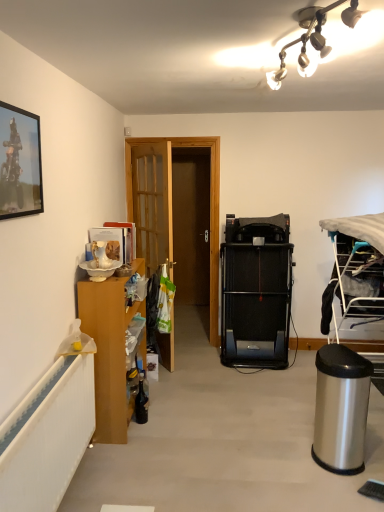
Question: Is wooden cabinet at left facing away from metallic silver picture frame at upper left?

Choices:
 (A) yes
 (B) no

Answer: (B)

Question: Can you confirm if wooden cabinet at left is shorter than metallic silver picture frame at upper left?

Choices:
 (A) no
 (B) yes

Answer: (A)

Question: Is metallic silver picture frame at upper left completely or partially inside wooden cabinet at left?

Choices:
 (A) yes
 (B) no

Answer: (B)

Question: Is wooden cabinet at left closer to camera compared to metallic silver picture frame at upper left?

Choices:
 (A) no
 (B) yes

Answer: (A)

Question: Does wooden cabinet at left have a greater width compared to metallic silver picture frame at upper left?

Choices:
 (A) no
 (B) yes

Answer: (B)

Question: In terms of size, does metallic silver picture frame at upper left appear bigger or smaller than wooden cabinet at left?

Choices:
 (A) big
 (B) small

Answer: (B)

Question: Choose the correct answer: Is metallic silver picture frame at upper left inside wooden cabinet at left or outside it?

Choices:
 (A) outside
 (B) inside

Answer: (A)

Question: Looking at their shapes, would you say metallic silver picture frame at upper left is wider or thinner than wooden cabinet at left?

Choices:
 (A) thin
 (B) wide

Answer: (A)

Question: From the image's perspective, relative to wooden cabinet at left, is metallic silver picture frame at upper left above or below?

Choices:
 (A) below
 (B) above

Answer: (B)

Question: From a real-world perspective, is wooden cabinet at left physically located above or below metallic silver picture frame at upper left?

Choices:
 (A) below
 (B) above

Answer: (A)

Question: Do you think wooden cabinet at left is within metallic silver picture frame at upper left, or outside of it?

Choices:
 (A) inside
 (B) outside

Answer: (B)

Question: From their relative heights in the image, would you say wooden cabinet at left is taller or shorter than metallic silver picture frame at upper left?

Choices:
 (A) tall
 (B) short

Answer: (A)

Question: Is wooden cabinet at left in front of or behind metallic silver picture frame at upper left in the image?

Choices:
 (A) behind
 (B) front

Answer: (A)

Question: Based on their positions, is wooden door at center located to the left or right of white glass light fixture at upper center?

Choices:
 (A) left
 (B) right

Answer: (A)

Question: Considering the positions of wooden door at center and white glass light fixture at upper center in the image, is wooden door at center taller or shorter than white glass light fixture at upper center?

Choices:
 (A) tall
 (B) short

Answer: (A)